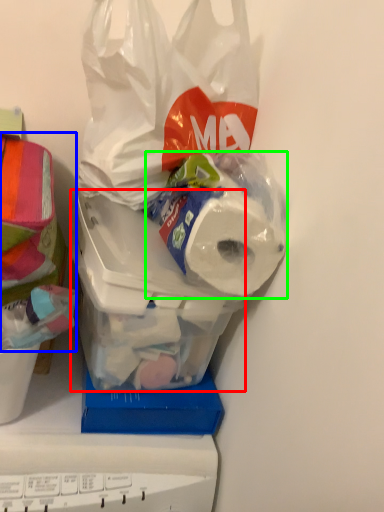
Question: Which is farther away from wide (highlighted by a red box)? wrapping paper (highlighted by a blue box) or toilet paper (highlighted by a green box)?

Choices:
 (A) wrapping paper
 (B) toilet paper

Answer: (A)